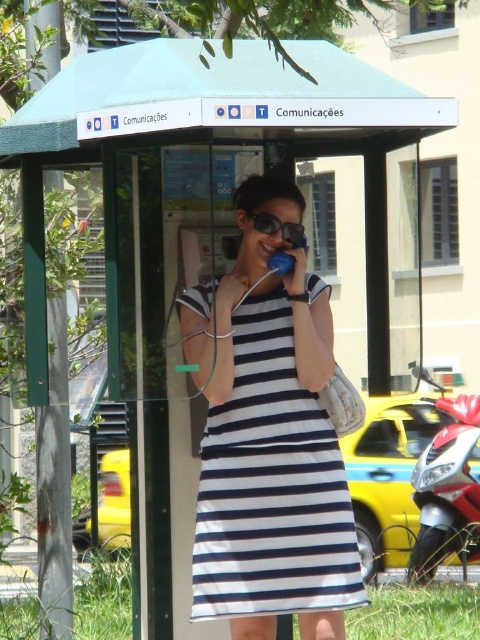
Is navy blue striped dress at center smaller than teal plastic canopy at upper center?

Indeed, navy blue striped dress at center has a smaller size compared to teal plastic canopy at upper center.

Is navy blue striped dress at center to the left of teal plastic canopy at upper center from the viewer's perspective?

In fact, navy blue striped dress at center is to the right of teal plastic canopy at upper center.

Who is more forward, (336, 513) or (200, 83)?

Positioned in front is point (200, 83).

Where is `navy blue striped dress at center`? navy blue striped dress at center is located at coordinates (271, 484).

Is navy blue striped dress at center bigger than sunglasses at center?

Indeed, navy blue striped dress at center has a larger size compared to sunglasses at center.

Describe the element at coordinates (271, 484) in the screenshot. I see `navy blue striped dress at center` at that location.

Who is more forward, [269,428] or [280,225]?

Positioned in front is point [269,428].

This screenshot has height=640, width=480. What are the coordinates of `navy blue striped dress at center` in the screenshot? It's located at (271, 484).

Which is more to the left, teal plastic canopy at upper center or sunglasses at center?

From the viewer's perspective, teal plastic canopy at upper center appears more on the left side.

Which is below, teal plastic canopy at upper center or sunglasses at center?

sunglasses at center

I want to click on teal plastic canopy at upper center, so click(214, 93).